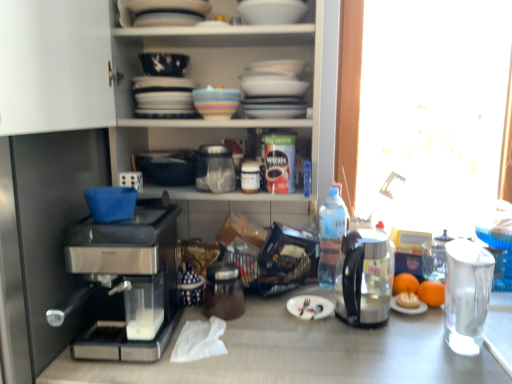
How much space does white glossy bowl at upper center, arranged as the first tableware when viewed from the top, occupy vertically?

12.14 centimeters.

Where is `sleek metallic coffee maker at left`? The width and height of the screenshot is (512, 384). sleek metallic coffee maker at left is located at coordinates (126, 282).

What do you see at coordinates (126, 282) in the screenshot?
I see `sleek metallic coffee maker at left` at bounding box center [126, 282].

From the picture: In order to face orange matte at right, arranged as the 1th orange when viewed from the right, should I rotate leftwards or rightwards?

To align with it, rotate right about 22.247°.

What do you see at coordinates (250, 177) in the screenshot? The height and width of the screenshot is (384, 512). I see `translucent plastic container at center, which ranks as the 3th bottle in back-to-front order` at bounding box center [250, 177].

Where is `matte black bowl at upper center`? Image resolution: width=512 pixels, height=384 pixels. matte black bowl at upper center is located at coordinates (164, 64).

Locate an element on the screen. transparent glass jar at center, placed as the 2th appliance when sorted from bottom to top is located at coordinates (215, 168).

Which is closer to the camera, (x=234, y=301) or (x=280, y=3)?

The point (x=280, y=3) is in front.

Considering the relative positions of shiny metallic coffee maker at center, the second appliance in the top-to-bottom sequence, and white glossy bowl at upper center, the first tableware from the right, in the image provided, is shiny metallic coffee maker at center, the second appliance in the top-to-bottom sequence, to the left of white glossy bowl at upper center, the first tableware from the right, from the viewer's perspective?

Indeed, shiny metallic coffee maker at center, the second appliance in the top-to-bottom sequence, is positioned on the left side of white glossy bowl at upper center, the first tableware from the right.

Is shiny metallic coffee maker at center, the second appliance in the top-to-bottom sequence, situated inside white glossy bowl at upper center, which is the second tableware in bottom-to-top order, or outside?

shiny metallic coffee maker at center, the second appliance in the top-to-bottom sequence, is located beyond the bounds of white glossy bowl at upper center, which is the second tableware in bottom-to-top order.

Which object is wider, shiny metallic coffee maker at center, the 1th appliance from the bottom, or white glossy bowl at upper center, the first tableware from the right?

With larger width is shiny metallic coffee maker at center, the 1th appliance from the bottom.

Which of these two, matte black bowl at upper center or white matte paper plate at center, is bigger?

With larger size is matte black bowl at upper center.

Is matte black bowl at upper center not inside white matte paper plate at center?

Yes, matte black bowl at upper center is located beyond the bounds of white matte paper plate at center.

Is matte black bowl at upper center wider than white matte paper plate at center?

No, matte black bowl at upper center is not wider than white matte paper plate at center.

Where is `the 2nd bottle positioned above the transparent glass coffee pot at right (from the image's perspective)`? This screenshot has height=384, width=512. the 2nd bottle positioned above the transparent glass coffee pot at right (from the image's perspective) is located at coordinates (330, 236).

From a real-world perspective, is transparent glass coffee pot at right positioned under transparent plastic bottle at right, the 3th bottle viewed from the front, based on gravity?

Yes, from a real-world perspective, transparent glass coffee pot at right is below transparent plastic bottle at right, the 3th bottle viewed from the front.

Could you tell me if transparent glass coffee pot at right is turned towards transparent plastic bottle at right, the 2th bottle from the left?

No, transparent glass coffee pot at right is not oriented towards transparent plastic bottle at right, the 2th bottle from the left.

Measure the distance between clear plastic bottle at right, which appears as the 2th bottle when viewed from the back, and white matte paper plate at center.

clear plastic bottle at right, which appears as the 2th bottle when viewed from the back, and white matte paper plate at center are 24.47 centimeters apart from each other.

In the scene shown: Is clear plastic bottle at right, the 1th bottle positioned from the right, taller or shorter than white matte paper plate at center?

Considering their sizes, clear plastic bottle at right, the 1th bottle positioned from the right, has more height than white matte paper plate at center.

Which is behind, clear plastic bottle at right, which appears as the 2th bottle when viewed from the back, or white matte paper plate at center?

clear plastic bottle at right, which appears as the 2th bottle when viewed from the back, is behind.

Which is correct: clear plastic bottle at right, which appears as the 2th bottle when viewed from the front, is inside white matte paper plate at center, or outside of it?

The correct answer is: outside.

Is orange matte at right, acting as the 2th orange starting from the left, to the left of transparent glass jar at center, placed as the 2th appliance when sorted from bottom to top, from the viewer's perspective?

Incorrect, orange matte at right, acting as the 2th orange starting from the left, is not on the left side of transparent glass jar at center, placed as the 2th appliance when sorted from bottom to top.

From the image's perspective, starting from the transparent glass jar at center, placed as the 2th appliance when sorted from bottom to top, which orange is the 2nd one below? Please provide its 2D coordinates.

[(431, 293)]

How distant is orange matte at right, arranged as the 1th orange when viewed from the right, from transparent glass jar at center, the first appliance in the top-to-bottom sequence?

27.19 inches.

From the image's perspective, would you say orange matte at right, acting as the 2th orange starting from the left, is shown under transparent glass jar at center, the first appliance in the top-to-bottom sequence?

Yes.

Looking at this image, can you tell me how much orange matte at right, acting as the 2th orange starting from the left, and matte black bowl at upper center differ in facing direction?

The angle between the facing direction of orange matte at right, acting as the 2th orange starting from the left, and the facing direction of matte black bowl at upper center is 17.6 degrees.

From a real-world perspective, is orange matte at right, arranged as the 1th orange when viewed from the right, on top of matte black bowl at upper center?

No, from a real-world perspective, orange matte at right, arranged as the 1th orange when viewed from the right, is not on top of matte black bowl at upper center.

Can you confirm if orange matte at right, arranged as the 1th orange when viewed from the right, is taller than matte black bowl at upper center?

Correct, orange matte at right, arranged as the 1th orange when viewed from the right, is much taller as matte black bowl at upper center.

Does orange matte at right, acting as the 2th orange starting from the left, have a smaller size compared to matte black bowl at upper center?

Yes.

Would you consider orange matte at right, acting as the 2th orange starting from the left, to be distant from clear plastic bottle at right, the 1th bottle positioned from the right?

orange matte at right, acting as the 2th orange starting from the left, is near clear plastic bottle at right, the 1th bottle positioned from the right, not far away.

From the image's perspective, is orange matte at right, arranged as the 1th orange when viewed from the right, on clear plastic bottle at right, positioned as the 3th bottle in left-to-right order?

No.

How different are the orientations of orange matte at right, acting as the 2th orange starting from the left, and clear plastic bottle at right, which appears as the 2th bottle when viewed from the front, in degrees?

3.01 degrees.

Identify the location of the 1st appliance behind when counting from the white glossy bowl at upper center, which is the second tableware in bottom-to-top order. (223, 291).

The width and height of the screenshot is (512, 384). Identify the location of bowl on the left of white matte paper plate at center. (164, 64).

Based on the photo, which object lies nearer to the anchor point transparent glass jar at center, the first appliance in the top-to-bottom sequence, multicolored ceramic bowl at center, placed as the first tableware when sorted from bottom to top, or silver metallic fork at center?

multicolored ceramic bowl at center, placed as the first tableware when sorted from bottom to top, is positioned closer to the anchor transparent glass jar at center, the first appliance in the top-to-bottom sequence.

When comparing their distances from orange matte fruit at right, does silver metallic fork at center or shiny metallic coffee maker at center, the 1th appliance from the bottom, seem closer?

Based on the image, silver metallic fork at center appears to be nearer to orange matte fruit at right.

Estimate the real-world distances between objects in this image. Which object is closer to multicolored ceramic bowl at center, which ranks as the 2th tableware in top-to-bottom order, transparent glass jar at center, the first appliance in the top-to-bottom sequence, or transparent glass coffee pot at right?

Among the two, transparent glass jar at center, the first appliance in the top-to-bottom sequence, is located nearer to multicolored ceramic bowl at center, which ranks as the 2th tableware in top-to-bottom order.

From the image, which object appears to be nearer to transparent plastic bottle at right, placed as the 1th bottle when sorted from back to front, multicolored ceramic bowl at center, placed as the first tableware when sorted from bottom to top, or shiny metallic coffee maker at center, the second appliance in the top-to-bottom sequence?

shiny metallic coffee maker at center, the second appliance in the top-to-bottom sequence, is closer to transparent plastic bottle at right, placed as the 1th bottle when sorted from back to front.

From the image, which object appears to be farther from matte black bowl at upper center, silver metallic fork at center or multicolored ceramic bowl at center, which ranks as the 2th tableware in top-to-bottom order?

silver metallic fork at center lies further to matte black bowl at upper center than the other object.

Looking at the image, which one is located closer to orange matte at right, marked as the first orange in a left-to-right arrangement, transparent plastic bottle at right, the 2th bottle from the left, or sleek metallic coffee maker at left?

Based on the image, transparent plastic bottle at right, the 2th bottle from the left, appears to be nearer to orange matte at right, marked as the first orange in a left-to-right arrangement.

Which object lies further to the anchor point orange matte fruit at right, white glossy bowl at upper center, arranged as the first tableware when viewed from the top, or silver metallic fork at center?

The object further to orange matte fruit at right is white glossy bowl at upper center, arranged as the first tableware when viewed from the top.

Considering their positions, is orange matte at right, marked as the first orange in a left-to-right arrangement, positioned closer to multicolored ceramic bowl at center, which is the second tableware from right to left, than orange matte at right, acting as the 2th orange starting from the left?

orange matte at right, marked as the first orange in a left-to-right arrangement, is positioned closer to the anchor multicolored ceramic bowl at center, which is the second tableware from right to left.

What are the coordinates of `bowl that lies between white glossy bowl at upper center, the first tableware from the right, and clear plastic bottle at right, which appears as the 2th bottle when viewed from the back, from top to bottom` in the screenshot? It's located at (164, 64).

Locate an element on the screen. Image resolution: width=512 pixels, height=384 pixels. orange between sleek metallic coffee maker at left and orange matte at right, acting as the 2th orange starting from the left, in the horizontal direction is located at coordinates (405, 283).

This screenshot has width=512, height=384. Identify the location of food located between sleek metallic coffee maker at left and orange matte at right, arranged as the 1th orange when viewed from the right, in the left-right direction. (407, 300).

Find the location of a particular element. Image resolution: width=512 pixels, height=384 pixels. appliance between white glossy bowl at upper center, the first tableware from the right, and translucent plastic container at center, positioned as the first bottle in left-to-right order, from top to bottom is located at coordinates (215, 168).